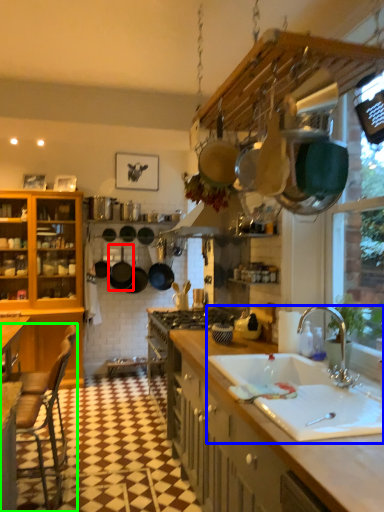
Question: Which object is positioned farthest from frying pan (highlighted by a red box)? Select from sink (highlighted by a blue box) and chair (highlighted by a green box).

Choices:
 (A) sink
 (B) chair

Answer: (A)